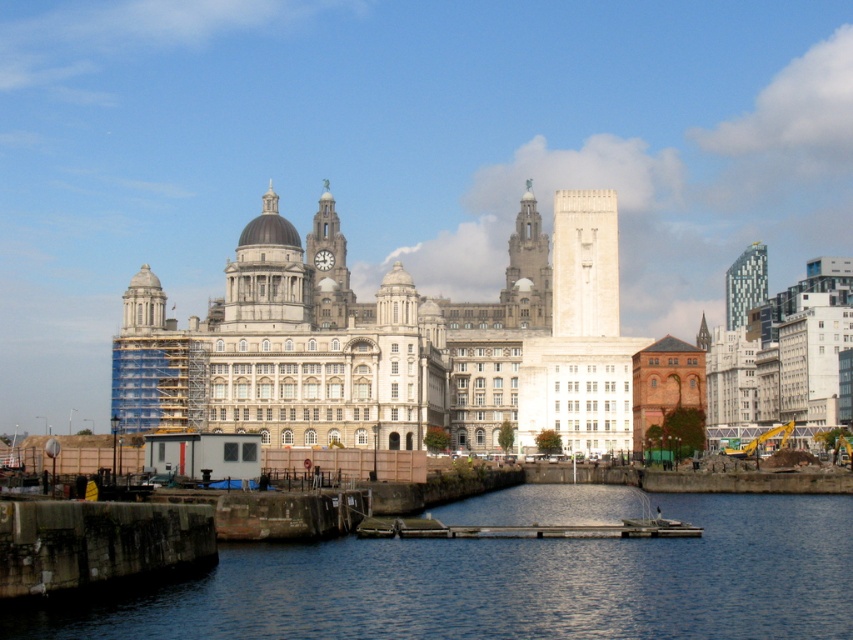
Question: Which object is farther from the camera taking this photo?

Choices:
 (A) glassy steel tower at upper right
 (B) white stone tower at center

Answer: (A)

Question: Which object is closer to the camera taking this photo?

Choices:
 (A) white stone clock tower at center
 (B) white stone dome at center
 (C) white stone tower at center
 (D) glassy steel tower at upper right

Answer: (C)

Question: Which object is the farthest from the white stone building at center?

Choices:
 (A) white stone tower at center
 (B) glassy steel tower at upper right
 (C) white stone clock tower at center

Answer: (B)

Question: Can you confirm if white stone building at center is positioned below white stone dome at center?

Choices:
 (A) no
 (B) yes

Answer: (B)

Question: Is white stone building at center above white stone dome at center?

Choices:
 (A) yes
 (B) no

Answer: (B)

Question: Is white stone tower at center below wooden dock at lower center?

Choices:
 (A) no
 (B) yes

Answer: (A)